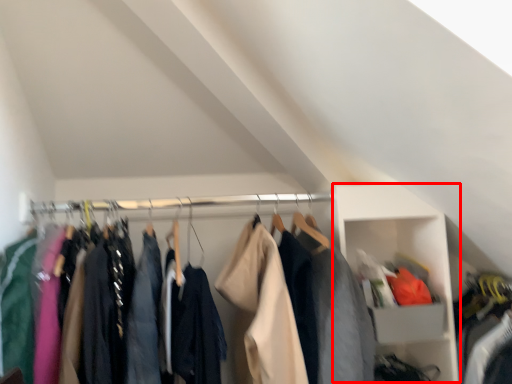
Question: In this image, where is cabinet (annotated by the red box) located relative to clothing?

Choices:
 (A) right
 (B) left

Answer: (A)